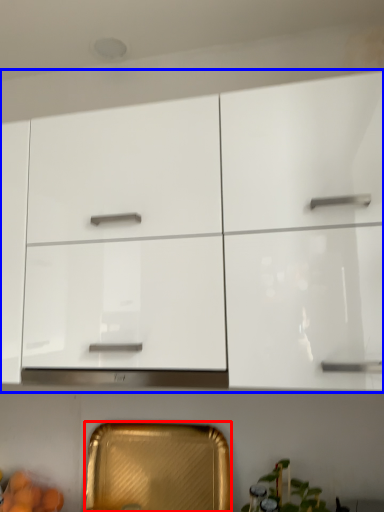
Question: Which object is closer to the camera taking this photo, cabinetry (highlighted by a red box) or cabinetry (highlighted by a blue box)?

Choices:
 (A) cabinetry
 (B) cabinetry

Answer: (B)